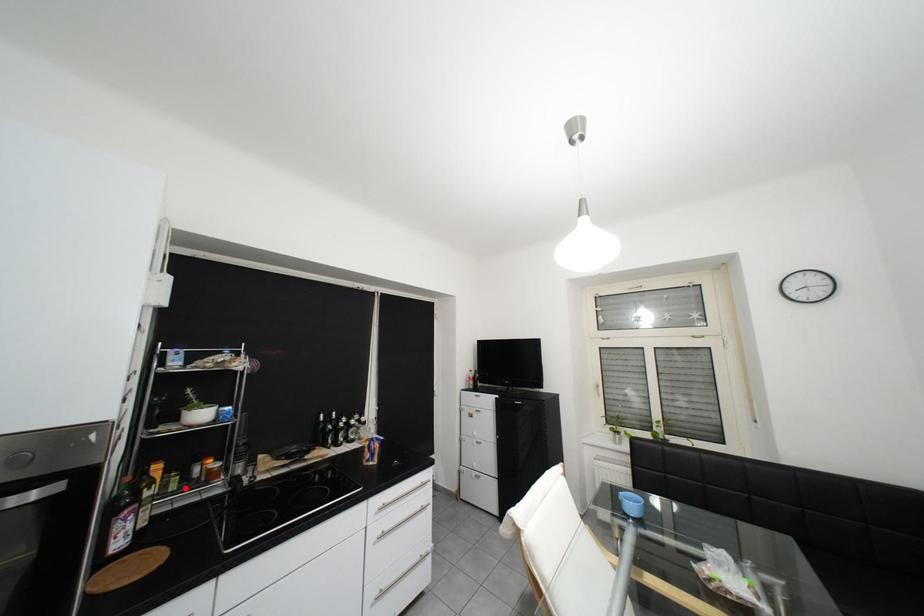
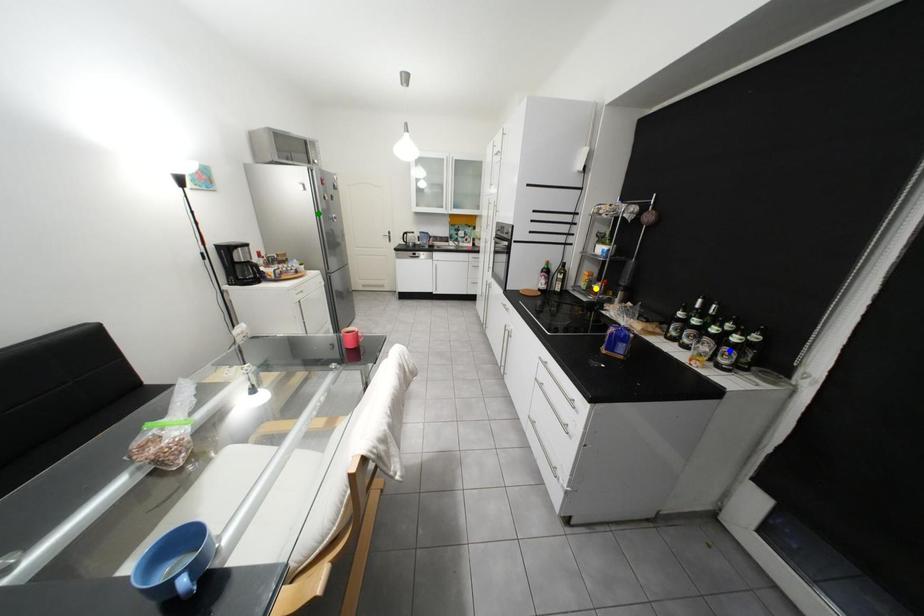
Question: I am providing you with two images of the same scene from different viewpoints. A red point is marked on the first image. You are given multiple points on the second image. Which spot in image 2 lines up with the point in image 1?

Choices:
 (A) green point
 (B) yellow point
 (C) blue point

Answer: (B)